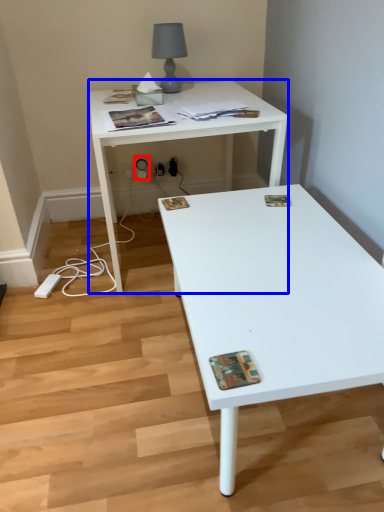
Question: Among these objects, which one is farthest to the camera, electric outlet (highlighted by a red box) or desk (highlighted by a blue box)?

Choices:
 (A) electric outlet
 (B) desk

Answer: (A)